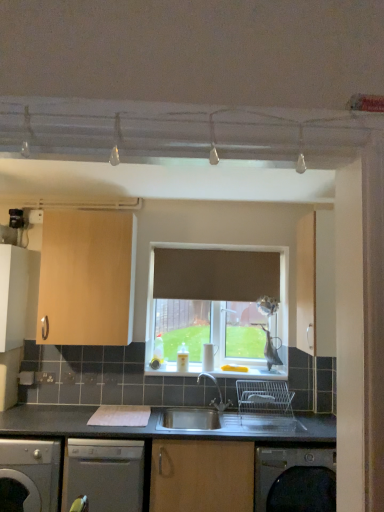
Question: Considering the positions of white matte cabinet at left, marked as the third cabinetry in a right-to-left arrangement, and matte wood cabinet at right, the 1th cabinetry positioned from the right, in the image, is white matte cabinet at left, marked as the third cabinetry in a right-to-left arrangement, bigger or smaller than matte wood cabinet at right, the 1th cabinetry positioned from the right,?

Choices:
 (A) small
 (B) big

Answer: (A)

Question: Is white matte cabinet at left, marked as the third cabinetry in a right-to-left arrangement, situated inside matte wood cabinet at right, arranged as the third cabinetry when viewed from the left, or outside?

Choices:
 (A) inside
 (B) outside

Answer: (B)

Question: Estimate the real-world distances between objects in this image. Which object is closer to the white matte cabinet at left, marked as the third cabinetry in a right-to-left arrangement?

Choices:
 (A) matte wood cabinet at right, arranged as the third cabinetry when viewed from the left
 (B) stainless steel sink at center
 (C) light wood cabinet at upper left, which is the 2th cabinetry in right-to-left order
 (D) satin silver dishwasher at lower left, the 2th dishwasher in the right-to-left sequence
 (E) satin silver dishwasher at lower center, acting as the first dishwasher starting from the right

Answer: (C)

Question: Based on their relative distances, which object is nearer to the satin silver dishwasher at lower center, the second dishwasher viewed from the left?

Choices:
 (A) light wood cabinet at upper left, which is the 2th cabinetry in right-to-left order
 (B) white matte cabinet at left, which appears as the 1th cabinetry when viewed from the left
 (C) white glossy window sill at center
 (D) satin silver dishwasher at lower left, the 2th dishwasher in the right-to-left sequence
 (E) matte wood cabinet at right, arranged as the third cabinetry when viewed from the left

Answer: (D)